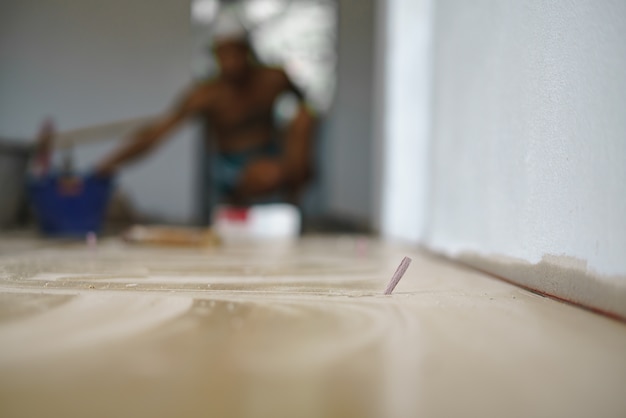
This screenshot has height=418, width=626. I want to click on white wall, so coord(592,124), coord(441,125), coord(69,62).